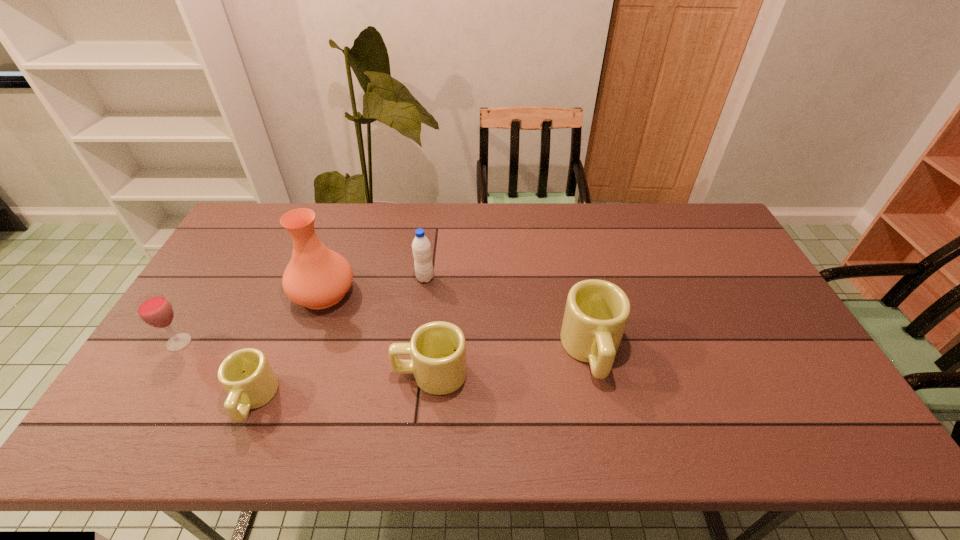
Image resolution: width=960 pixels, height=540 pixels. Find the location of `empty space that is in between the shortest mug and the tallest object`. empty space that is in between the shortest mug and the tallest object is located at coordinates (288, 346).

The height and width of the screenshot is (540, 960). Find the location of `free space between the leftmost object and the vase`. free space between the leftmost object and the vase is located at coordinates (252, 318).

You are a GUI agent. You are given a task and a screenshot of the screen. Output one action in this format:
    pyautogui.click(x=<x>, y=<y>)
    Task: Click on the free spot between the second shortest object and the wineglass
    Image resolution: width=960 pixels, height=540 pixels.
    Given the screenshot: What is the action you would take?
    pyautogui.click(x=304, y=358)

Identify the location of empty space between the leftmost mug and the water bottle. (339, 339).

At what (x,y) coordinates should I click in order to perform the action: click on vacant region between the water bottle and the tallest object. Please return your answer as a coordinate pair (x, y). This screenshot has width=960, height=540. Looking at the image, I should click on (374, 285).

Find the location of a particular element. vacant space in between the rightmost object and the water bottle is located at coordinates (508, 314).

Where is `free space between the tallest mug and the leftmost object`? Image resolution: width=960 pixels, height=540 pixels. free space between the tallest mug and the leftmost object is located at coordinates [385, 346].

Where is `vacant space that's between the wineglass and the tallest mug`? The height and width of the screenshot is (540, 960). vacant space that's between the wineglass and the tallest mug is located at coordinates (385, 346).

You are a GUI agent. You are given a task and a screenshot of the screen. Output one action in this format:
    pyautogui.click(x=<x>, y=<y>)
    Task: Click on the free point between the wineglass and the water bottle
    This screenshot has width=960, height=540.
    Given the screenshot: What is the action you would take?
    pyautogui.click(x=302, y=310)

Identify which object is the fourth closest to the water bottle. Please provide its 2D coordinates. Your answer should be formatted as a tuple, i.e. [(x, y)], where the tuple contains the x and y coordinates of a point satisfying the conditions above.

[(246, 375)]